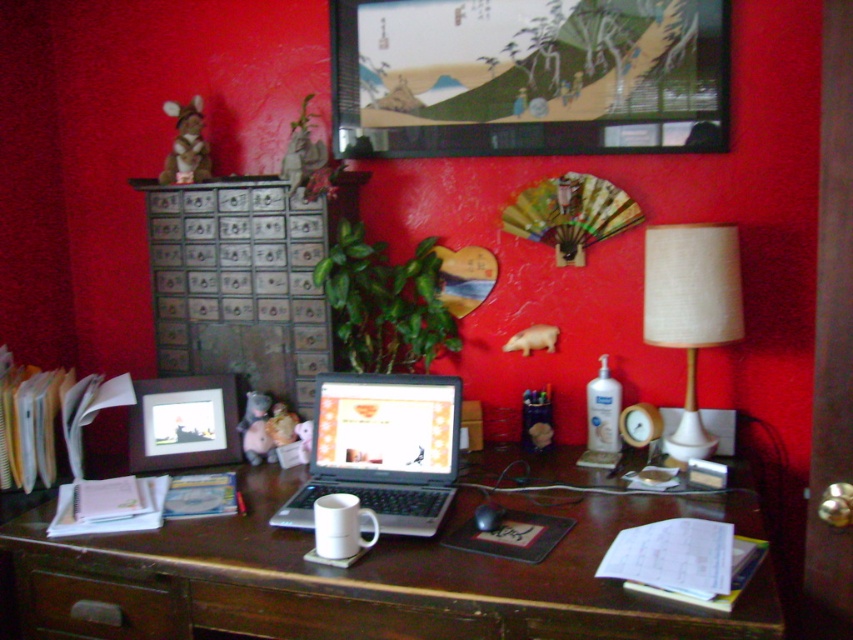
You are a delivery person who needs to place a rectangular box that is 60 centimeters long on the desk between the wooden file cabinet at left and the white fabric lampshade at right. Is there enough space for the box?

The distance between the wooden file cabinet at left and the white fabric lampshade at right is 77.56 centimeters. Since the box is 60 centimeters long, there is sufficient space to place it between them.

What object is located at the point with coordinates (242, 280)?

The wooden file cabinet at left is located at the point with coordinates (242, 280).